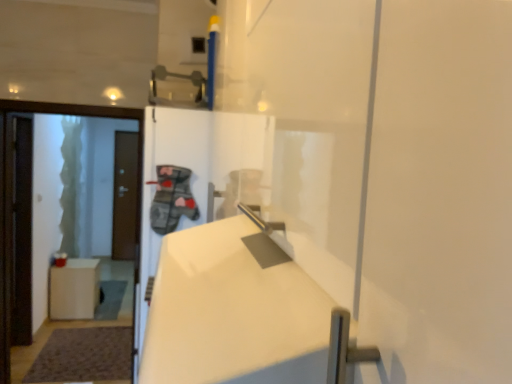
The width and height of the screenshot is (512, 384). Identify the location of free space in front of white matte trash can at lower left. (69, 321).